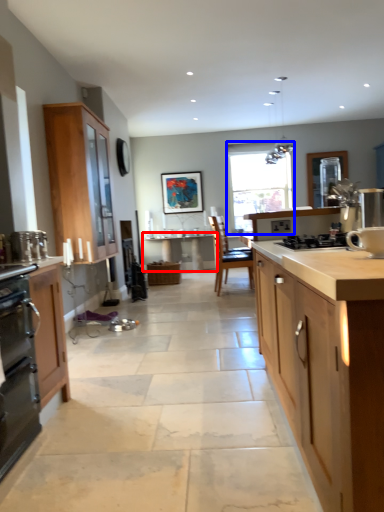
Question: Which object appears closest to the camera in this image, table (highlighted by a red box) or window (highlighted by a blue box)?

Choices:
 (A) table
 (B) window

Answer: (A)